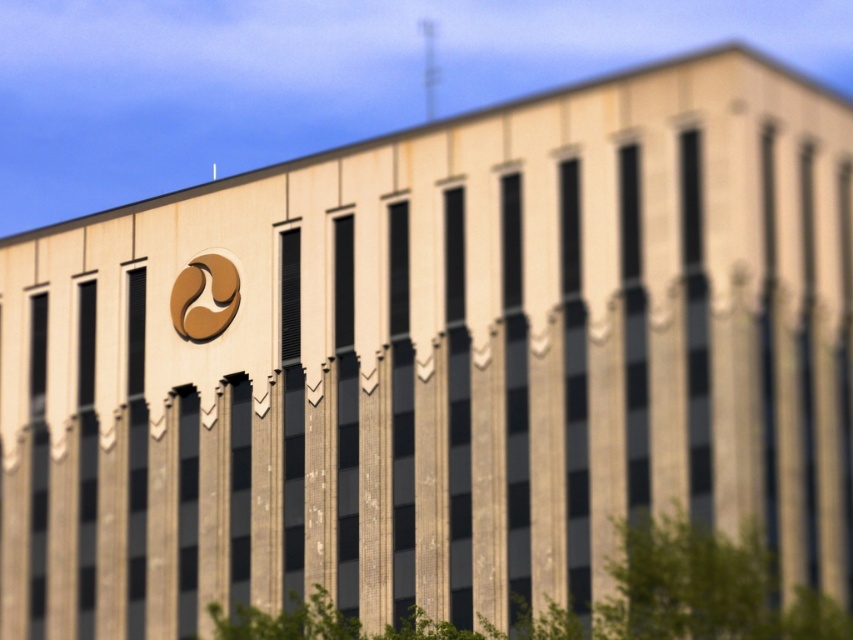
Does green leafy tree at lower center have a greater width compared to gold metallic logo at upper center?

Yes, green leafy tree at lower center is wider than gold metallic logo at upper center.

Is point (709, 628) positioned before point (173, 312)?

Yes.

At what (x,y) coordinates should I click in order to perform the action: click on green leafy tree at lower center. Please return your answer as a coordinate pair (x, y). Image resolution: width=853 pixels, height=640 pixels. Looking at the image, I should click on (608, 600).